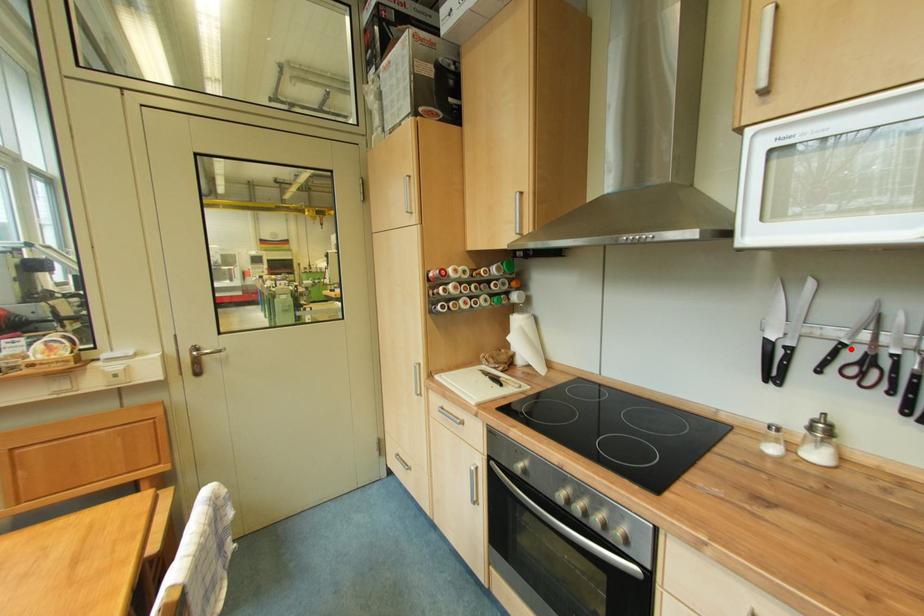
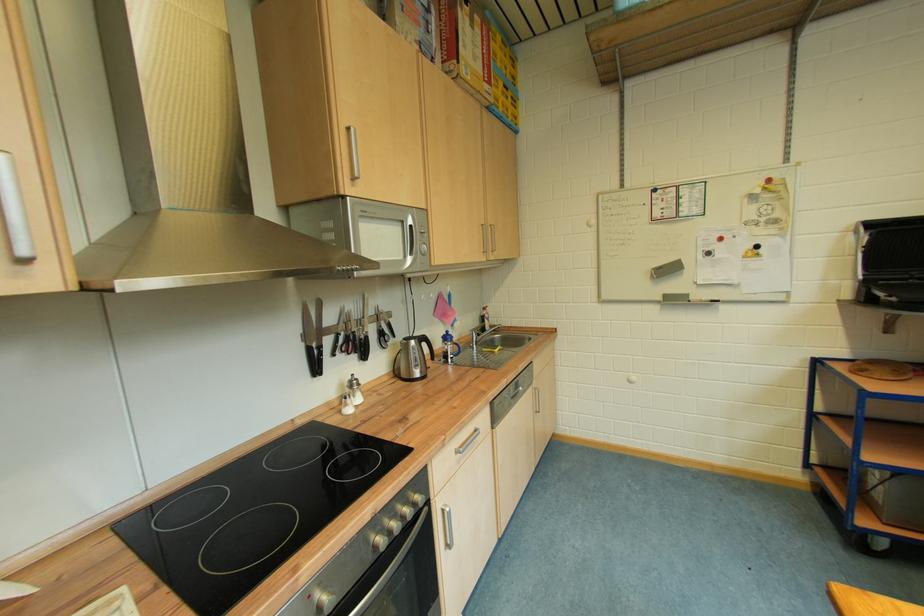
Find the pixel in the second image that matches the highlighted location in the first image.

(345, 338)